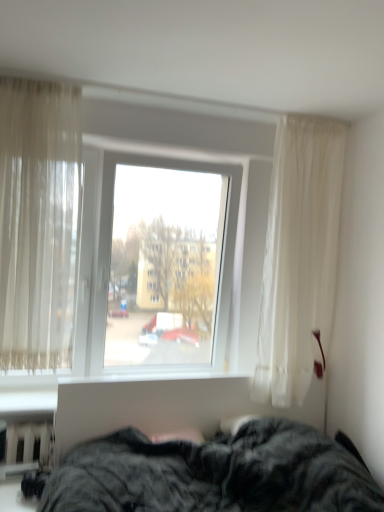
Question: Would you say dark gray plush bed at lower center contains sheer beige curtain at left?

Choices:
 (A) yes
 (B) no

Answer: (B)

Question: From the image's perspective, is dark gray plush bed at lower center on top of sheer beige curtain at left?

Choices:
 (A) yes
 (B) no

Answer: (B)

Question: Is dark gray plush bed at lower center closer to the viewer compared to sheer beige curtain at left?

Choices:
 (A) yes
 (B) no

Answer: (A)

Question: Is dark gray plush bed at lower center bigger than sheer beige curtain at left?

Choices:
 (A) yes
 (B) no

Answer: (A)

Question: Is dark gray plush bed at lower center looking in the opposite direction of sheer beige curtain at left?

Choices:
 (A) yes
 (B) no

Answer: (B)

Question: Considering the positions of point (49, 441) and point (322, 282), is point (49, 441) closer or farther from the camera than point (322, 282)?

Choices:
 (A) closer
 (B) farther

Answer: (A)

Question: Based on their positions, is white plastic radiator at lower left located to the left or right of transparent glass window at center?

Choices:
 (A) left
 (B) right

Answer: (A)

Question: Is white plastic radiator at lower left in front of or behind transparent glass window at center in the image?

Choices:
 (A) front
 (B) behind

Answer: (A)

Question: Considering the positions of white plastic radiator at lower left and transparent glass window at center in the image, is white plastic radiator at lower left bigger or smaller than transparent glass window at center?

Choices:
 (A) small
 (B) big

Answer: (A)

Question: Is point tap(51, 432) positioned closer to the camera than point tap(97, 474)?

Choices:
 (A) farther
 (B) closer

Answer: (A)

Question: In terms of width, does white plastic radiator at lower left look wider or thinner when compared to dark gray plush bed at lower center?

Choices:
 (A) thin
 (B) wide

Answer: (A)

Question: In the image, is white plastic radiator at lower left positioned in front of or behind dark gray plush bed at lower center?

Choices:
 (A) behind
 (B) front

Answer: (A)

Question: From a real-world perspective, is white plastic radiator at lower left above or below dark gray plush bed at lower center?

Choices:
 (A) below
 (B) above

Answer: (B)

Question: In terms of height, does sheer beige curtain at left look taller or shorter compared to white plastic radiator at lower left?

Choices:
 (A) short
 (B) tall

Answer: (B)

Question: Which is correct: sheer beige curtain at left is inside white plastic radiator at lower left, or outside of it?

Choices:
 (A) inside
 (B) outside

Answer: (B)